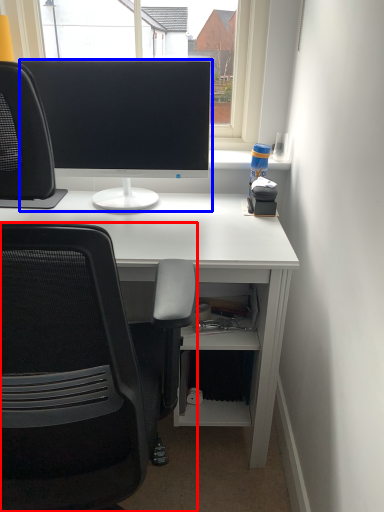
Question: Which of the following is the closest to the observer, chair (highlighted by a red box) or computer monitor (highlighted by a blue box)?

Choices:
 (A) chair
 (B) computer monitor

Answer: (A)